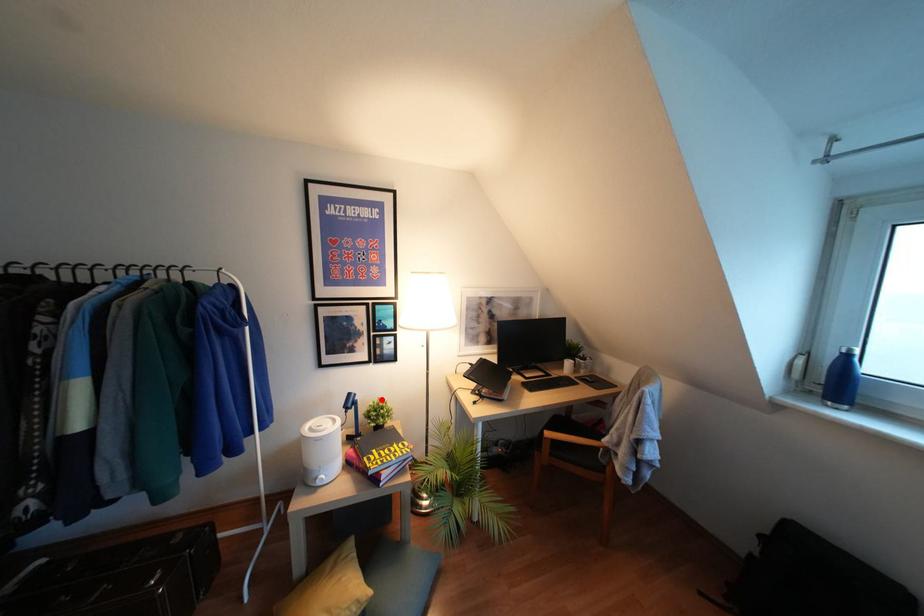
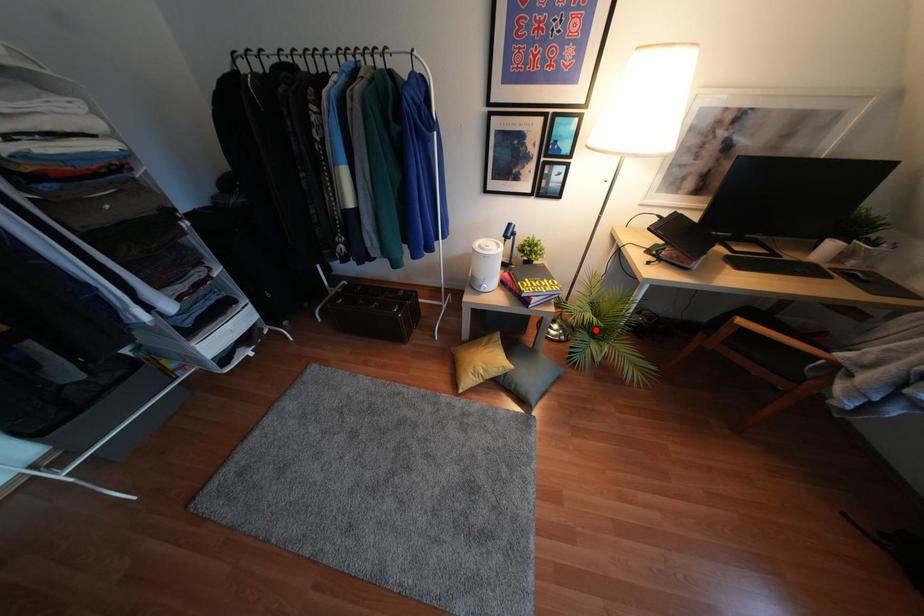
I am providing you with two images of the same scene from different viewpoints. A red point is marked on the first image and another point is marked on the second image. Is the red point in image1 aligned with the point shown in image2?

No